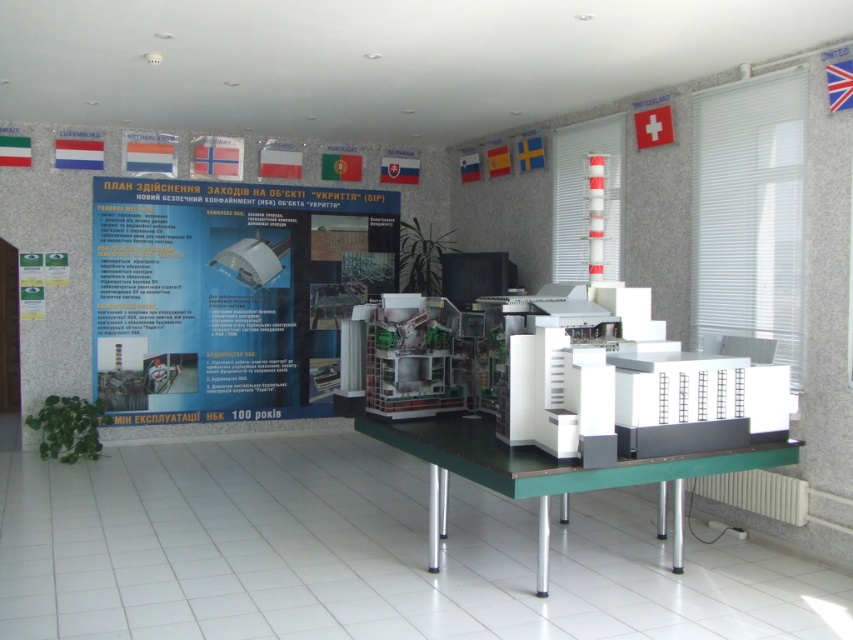
You are a visitor in the conference room and want to place a small note on the table near the model of the nuclear power plant. The note must be placed exactly at the coordinates given for the white paper at center. What are the coordinates where you should place the note?

The coordinates for the white paper at center are point [229,294], so you should place the note at those coordinates.

You are organizing a presentation in the conference room and need to place a large map on the table. The map is exactly the same size as the white paper at center. Will the map fit on the green plastic table at center?

The white paper at center is larger in width than the green plastic table at center, so the map, being the same size as the white paper at center, will not fit on the green plastic table at center.